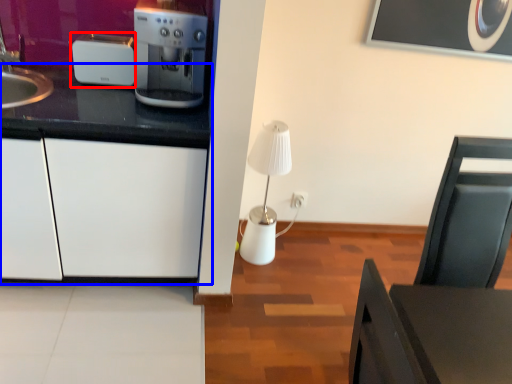
Question: Which point is further to the camera, kitchen appliance (highlighted by a red box) or cabinetry (highlighted by a blue box)?

Choices:
 (A) kitchen appliance
 (B) cabinetry

Answer: (A)